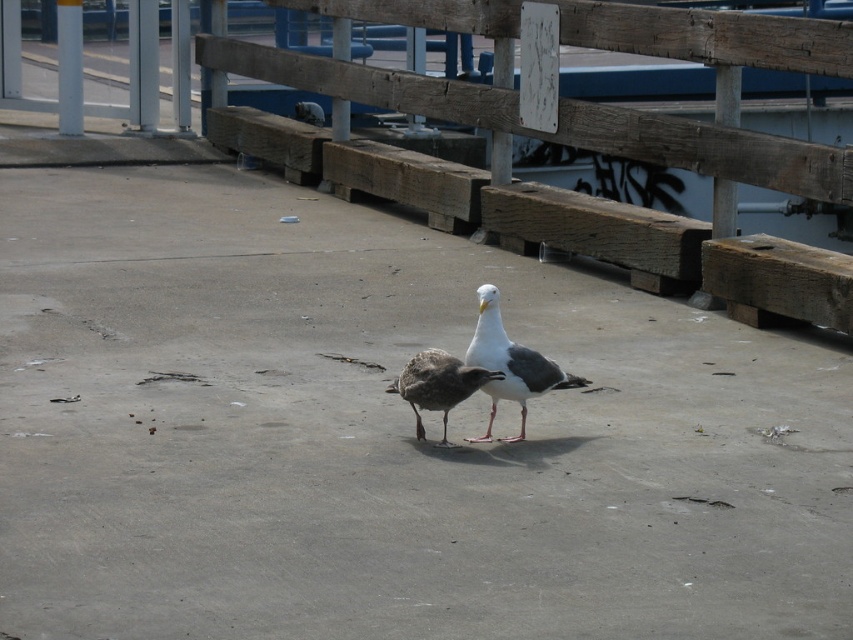
Does wooden at center have a lesser width compared to white matte seagull at center?

Yes, wooden at center is thinner than white matte seagull at center.

Who is positioned more to the right, wooden at center or white matte seagull at center?

wooden at center

Does point (361, 19) lie behind point (471, 440)?

Yes, it is.

Identify the location of wooden at center. Image resolution: width=853 pixels, height=640 pixels. (567, 99).

Is white matte seagull at center smaller than brown feathered bird at center?

No.

Measure the distance from white matte seagull at center to brown feathered bird at center.

A distance of 6.43 inches exists between white matte seagull at center and brown feathered bird at center.

The width and height of the screenshot is (853, 640). What are the coordinates of `white matte seagull at center` in the screenshot? It's located at (509, 364).

Between wooden at center and brown feathered bird at center, which one is positioned lower?

brown feathered bird at center is lower down.

In order to click on wooden at center in this screenshot , I will do `click(567, 99)`.